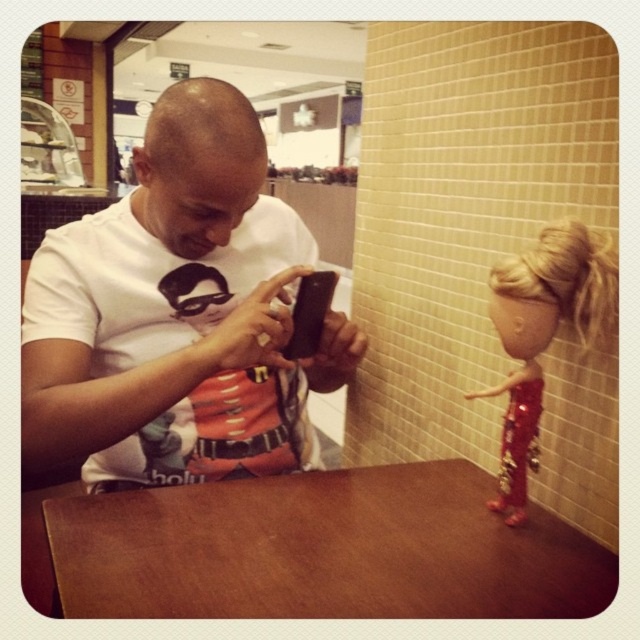
Is shiny red fabric doll at right behind black matte smartphone at center?

No, shiny red fabric doll at right is closer to the viewer.

Does shiny red fabric doll at right come in front of black matte smartphone at center?

Yes.

Is point (582, 330) closer to viewer compared to point (298, 346)?

No, it is behind (298, 346).

Find the location of a particular element. This screenshot has height=640, width=640. shiny red fabric doll at right is located at coordinates (541, 337).

Who is higher up, white matte shirt at center or black matte smartphone at center?

Positioned higher is black matte smartphone at center.

Who is positioned more to the right, white matte shirt at center or black matte smartphone at center?

Positioned to the right is black matte smartphone at center.

Find the location of a particular element. This screenshot has height=640, width=640. white matte shirt at center is located at coordinates (177, 316).

You are a GUI agent. You are given a task and a screenshot of the screen. Output one action in this format:
    pyautogui.click(x=<x>, y=<y>)
    Task: Click on the white matte shirt at center
    
    Given the screenshot: What is the action you would take?
    pyautogui.click(x=177, y=316)

Between point (97, 253) and point (584, 337), which one is positioned behind?

Positioned behind is point (584, 337).

Who is more forward, (x=342, y=381) or (x=540, y=317)?

Positioned in front is point (x=540, y=317).

Identify the location of white matte shirt at center. The height and width of the screenshot is (640, 640). (177, 316).